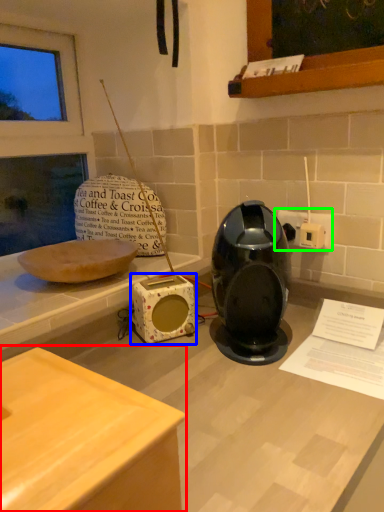
Question: Which object is positioned farthest from table (highlighted by a red box)? Select from appliance (highlighted by a blue box) and electric outlet (highlighted by a green box).

Choices:
 (A) appliance
 (B) electric outlet

Answer: (B)